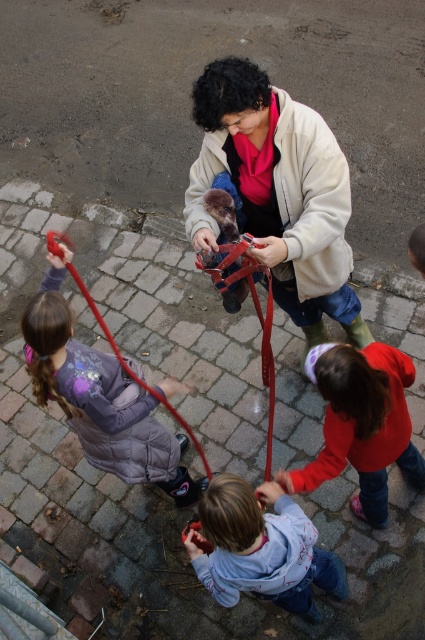
You are a photographer trying to capture a candid shot of the purple fuzzy jacket at lower left and the furry brown dog at center without them noticing. What is the minimum distance you need to maintain between your camera and the subjects to ensure both are in focus?

The purple fuzzy jacket at lower left is 39.32 inches away from the furry brown dog at center. To keep both in focus, the photographer should maintain a distance where the depth of field can cover the 39.32 inches between them, typically requiring a smaller aperture setting on the camera.

You are a photographer trying to capture a group photo of the purple fuzzy jacket at lower left and the furry brown dog at center. Which subject should you focus on first if you want to ensure both are in frame without moving the camera? Explain your reasoning based on their sizes.

The purple fuzzy jacket at lower left is bigger than the furry brown dog at center. Since the purple fuzzy jacket at lower left is larger, it will take up more space in the frame. Therefore, you should focus on positioning the purple fuzzy jacket at lower left first to ensure it fits within the camera frame, then adjust to include the smaller furry brown dog at center without moving the camera.